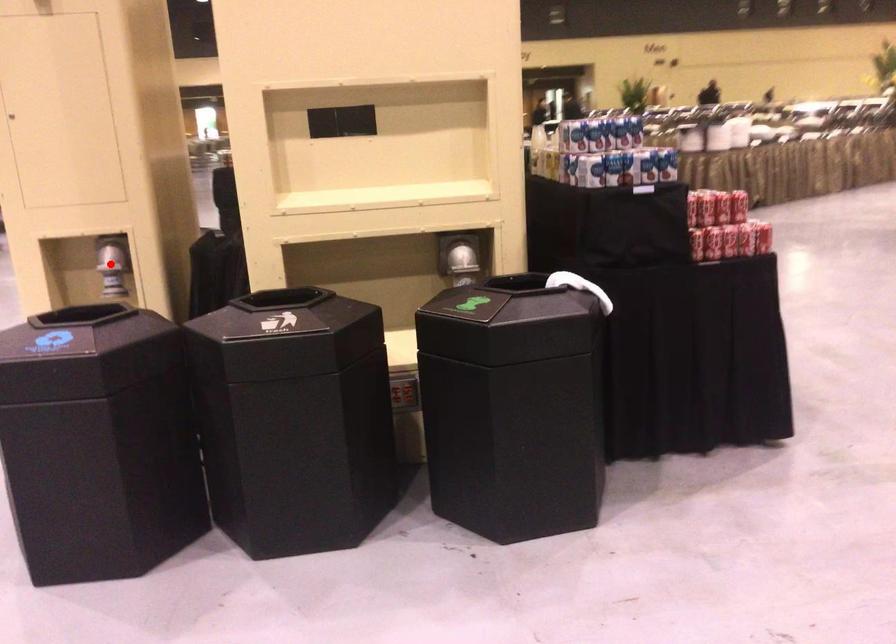
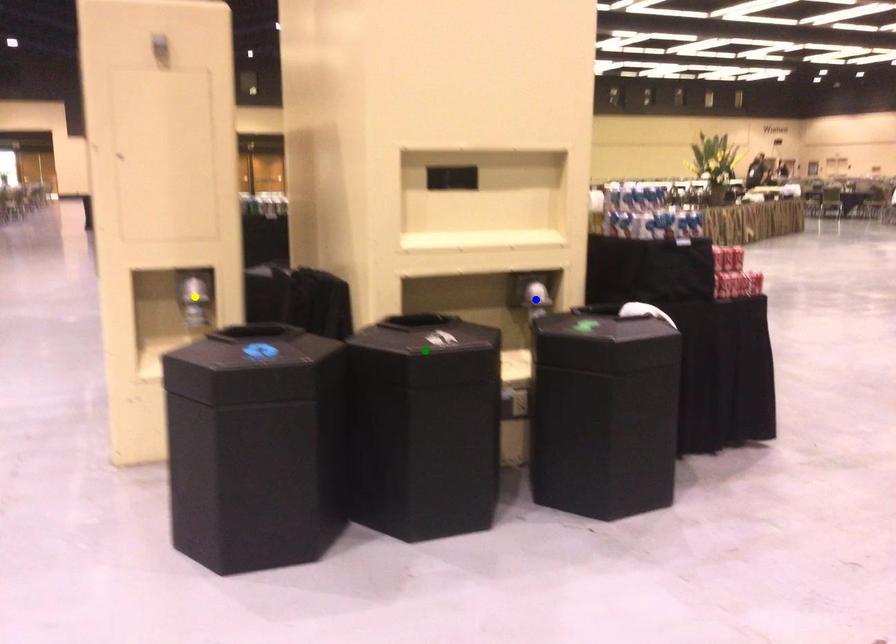
Question: I am providing you with two images of the same scene from different viewpoints. A red point is marked on the first image. You are given multiple points on the second image. In image 2, which mark is for the same physical point as the one in image 1?

Choices:
 (A) green point
 (B) yellow point
 (C) blue point

Answer: (B)